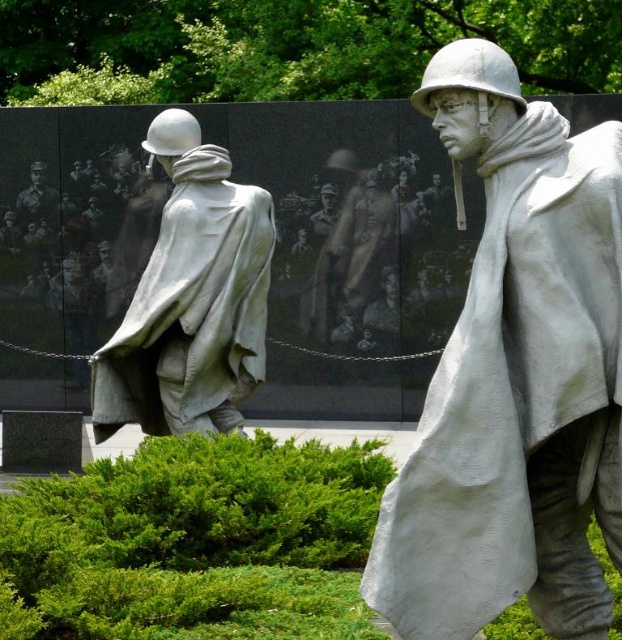
Question: Estimate the real-world distances between objects in this image. Which object is farther from the white matte helmet at center?

Choices:
 (A) matte black uniform at center
 (B) matte silver statue at left

Answer: (A)

Question: Which object appears farthest from the camera in this image?

Choices:
 (A) white matte helmet at center
 (B) matte silver statue at left

Answer: (B)

Question: Observing the image, what is the correct spatial positioning of white matte helmet at center in reference to matte silver statue at left?

Choices:
 (A) below
 (B) above

Answer: (A)

Question: Can you confirm if white matte helmet at center is smaller than matte black uniform at center?

Choices:
 (A) yes
 (B) no

Answer: (B)

Question: Can you confirm if white matte helmet at center is positioned below matte black uniform at center?

Choices:
 (A) yes
 (B) no

Answer: (A)

Question: Which point appears closest to the camera in this image?

Choices:
 (A) (534, 188)
 (B) (16, 202)

Answer: (A)